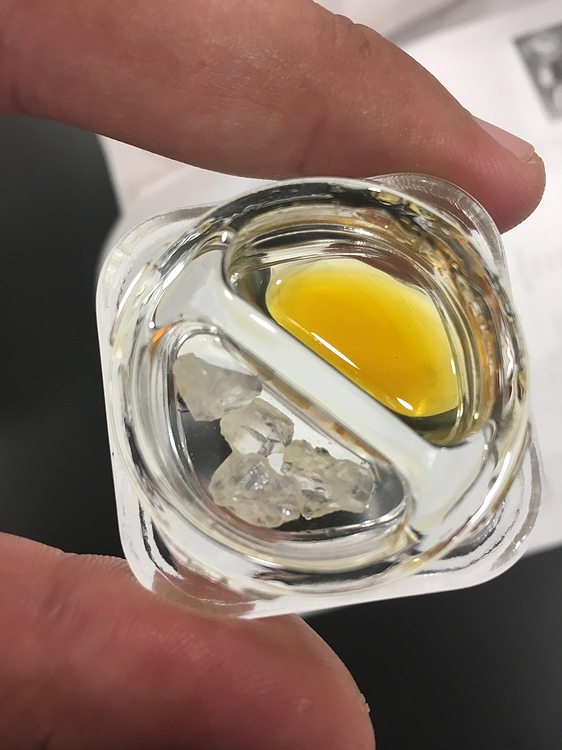
Identify the location of glass jar square. This screenshot has height=750, width=562. (407, 577).